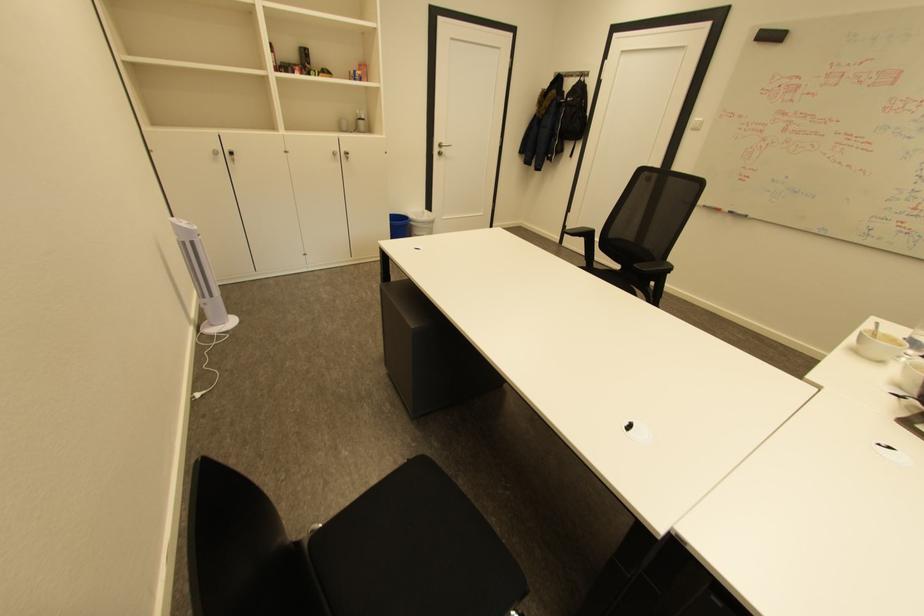
In order to click on silver door handle in this screenshot , I will do `click(441, 148)`.